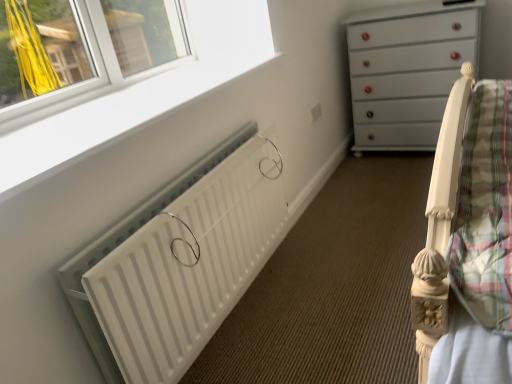
Question: From the image's perspective, would you say white plastic window frame at upper left is positioned over white glossy chest of drawers at upper right?

Choices:
 (A) no
 (B) yes

Answer: (A)

Question: Is white plastic window frame at upper left positioned behind white glossy chest of drawers at upper right?

Choices:
 (A) yes
 (B) no

Answer: (B)

Question: Is white plastic window frame at upper left not inside white glossy chest of drawers at upper right?

Choices:
 (A) yes
 (B) no

Answer: (A)

Question: From the image's perspective, is white plastic window frame at upper left beneath white glossy chest of drawers at upper right?

Choices:
 (A) yes
 (B) no

Answer: (A)

Question: Does white plastic window frame at upper left have a larger size compared to white glossy chest of drawers at upper right?

Choices:
 (A) yes
 (B) no

Answer: (B)

Question: Does white plastic window frame at upper left have a lesser height compared to white glossy chest of drawers at upper right?

Choices:
 (A) no
 (B) yes

Answer: (B)

Question: Are white glossy chest of drawers at upper right and white plastic window frame at upper left beside each other?

Choices:
 (A) yes
 (B) no

Answer: (B)

Question: Does white glossy chest of drawers at upper right have a smaller size compared to white plastic window frame at upper left?

Choices:
 (A) no
 (B) yes

Answer: (A)

Question: From the image's perspective, is white glossy chest of drawers at upper right above white plastic window frame at upper left?

Choices:
 (A) no
 (B) yes

Answer: (B)

Question: Could white plastic window frame at upper left be considered to be inside white glossy chest of drawers at upper right?

Choices:
 (A) no
 (B) yes

Answer: (A)

Question: Is white glossy chest of drawers at upper right at the left side of white plastic window frame at upper left?

Choices:
 (A) yes
 (B) no

Answer: (B)

Question: Does white glossy chest of drawers at upper right have a greater height compared to white plastic window frame at upper left?

Choices:
 (A) no
 (B) yes

Answer: (B)

Question: Is white matte radiator at lower left completely or partially outside of white glossy chest of drawers at upper right?

Choices:
 (A) no
 (B) yes

Answer: (B)